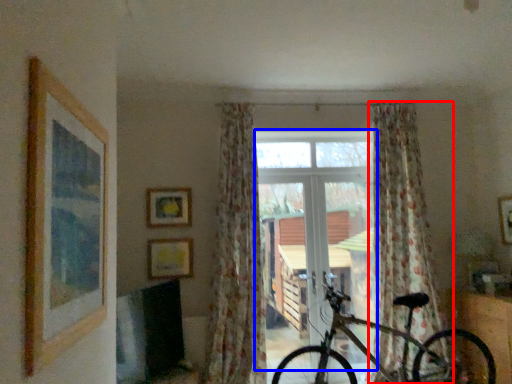
Question: Which of the following is the closest to the observer, curtain (highlighted by a red box) or window frame (highlighted by a blue box)?

Choices:
 (A) curtain
 (B) window frame

Answer: (A)